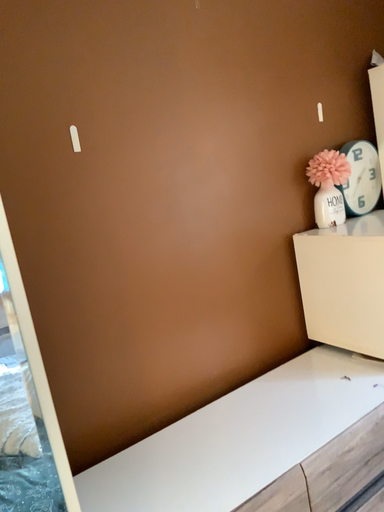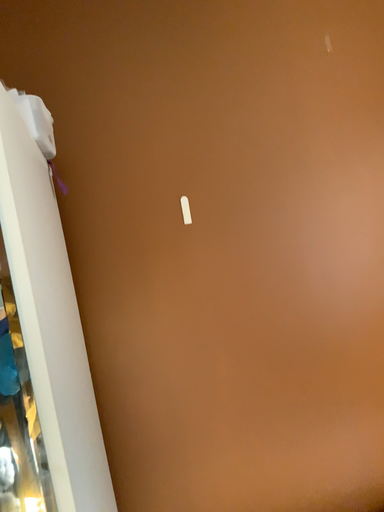
Question: How did the camera likely rotate when shooting the video?

Choices:
 (A) rotated right
 (B) rotated left

Answer: (B)